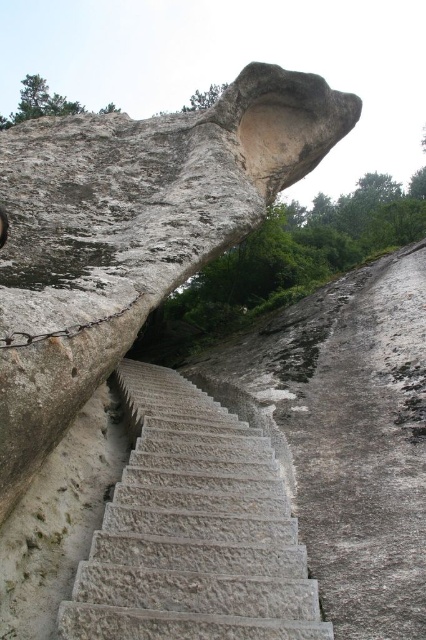
Does smooth gray rock at center appear on the right side of gray stone stairs at center?

Incorrect, smooth gray rock at center is not on the right side of gray stone stairs at center.

Measure the distance between point (69, 289) and camera.

They are 60.41 meters apart.

What are the coordinates of `smooth gray rock at center` in the screenshot? It's located at (131, 232).